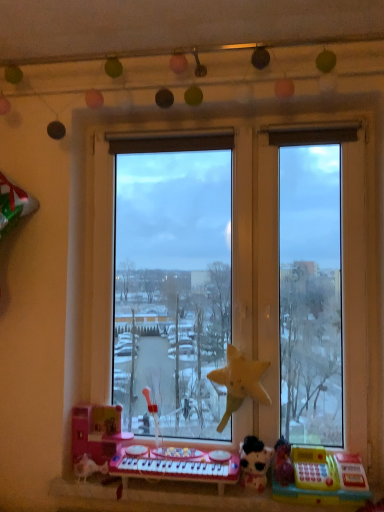
You are a GUI agent. You are given a task and a screenshot of the screen. Output one action in this format:
    pyautogui.click(x=<x>, y=<y>)
    Task: Click on the free spot to the left of white plush cat at lower right, which is counted as the third toy, starting from the left
    The width and height of the screenshot is (384, 512).
    Given the screenshot: What is the action you would take?
    pyautogui.click(x=216, y=494)